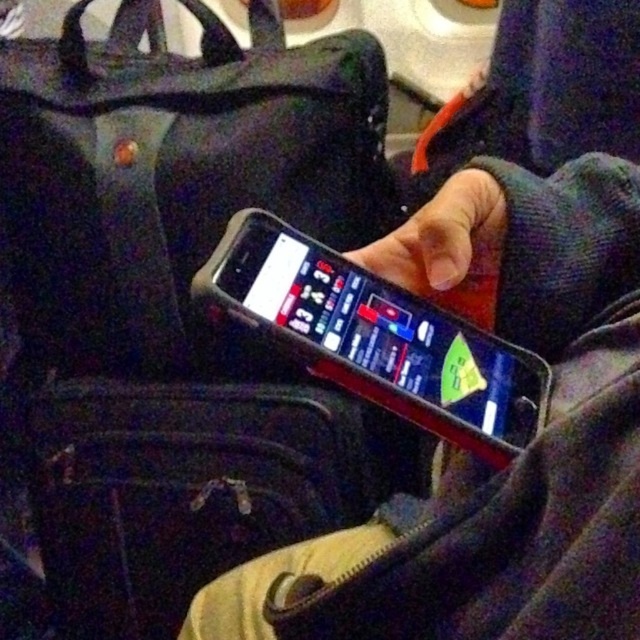
You are a traveler who just arrived at the airport and need to store your black rubberized smartphone at center. You have a black fabric suitcase at center. Can you fit the smartphone into the suitcase?

The black fabric suitcase at center is much taller than the black rubberized smartphone at center, so yes, the smartphone can fit inside the suitcase.

You are packing for a trip and have a black fabric bag at center and a black fabric suitcase at center. Which one can you stack another item on top of more easily?

The black fabric suitcase at center can be stacked more easily since it has a smaller height compared to the black fabric bag at center, making it more stable for stacking.

You are a delivery person who needs to place the black rubberized smartphone at center into the black fabric suitcase at center. The smartphone is currently on a table. Can you fit it inside without moving the suitcase?

The distance between the black fabric suitcase at center and the black rubberized smartphone at center is 18.28 inches. Since the smartphone is on the table and the suitcase is also at the center, you can easily pick up the smartphone and place it into the suitcase as they are positioned close to each other.